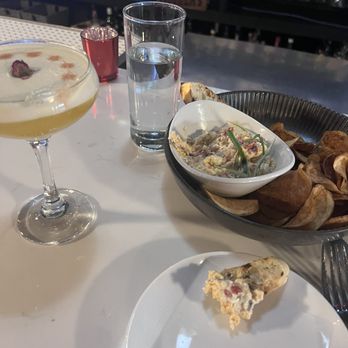
Locate an element on the screen. glass is located at coordinates (41, 227).